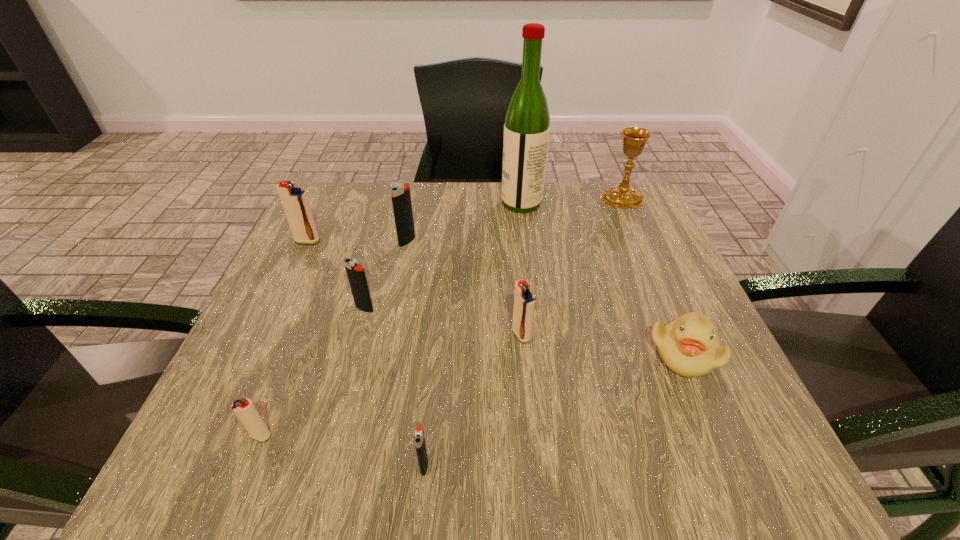
At what (x,y) coordinates should I click in order to perform the action: click on vacant space located 0.130m on the front of the leftmost object. Please return your answer as a coordinate pair (x, y). This screenshot has width=960, height=540. Looking at the image, I should click on (286, 285).

Where is `vacant region located on the front of the fourth object from left to right`? vacant region located on the front of the fourth object from left to right is located at coordinates (396, 302).

Locate an element on the screen. This screenshot has width=960, height=540. free location located on the right of the second nearest black igniter is located at coordinates (533, 309).

Identify the location of vacant position located 0.200m on the back of the fourth farthest igniter. (x=515, y=256).

Where is `vacant area situated 0.070m on the beak of the yellow duckling`? The image size is (960, 540). vacant area situated 0.070m on the beak of the yellow duckling is located at coordinates (712, 421).

What are the coordinates of `free spot located on the back of the fifth igniter from right to left` in the screenshot? It's located at (285, 372).

Locate an element on the screen. free location located 0.330m on the right of the rightmost black igniter is located at coordinates (665, 465).

Locate an element on the screen. The width and height of the screenshot is (960, 540). liquor at the far edge is located at coordinates (527, 121).

Locate an element on the screen. Image resolution: width=960 pixels, height=540 pixels. chalice located at the far edge is located at coordinates (621, 195).

You are a GUI agent. You are given a task and a screenshot of the screen. Output one action in this format:
    pyautogui.click(x=<x>, y=<y>)
    Task: Click on the chalice positioned at the right edge
    The height and width of the screenshot is (540, 960).
    Given the screenshot: What is the action you would take?
    pyautogui.click(x=621, y=195)